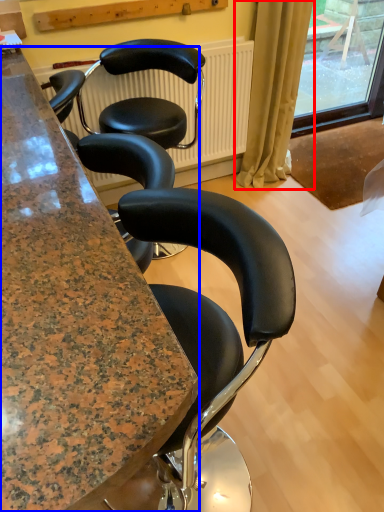
Question: Which point is further to the camera, curtain (highlighted by a red box) or cabinetry (highlighted by a blue box)?

Choices:
 (A) curtain
 (B) cabinetry

Answer: (A)